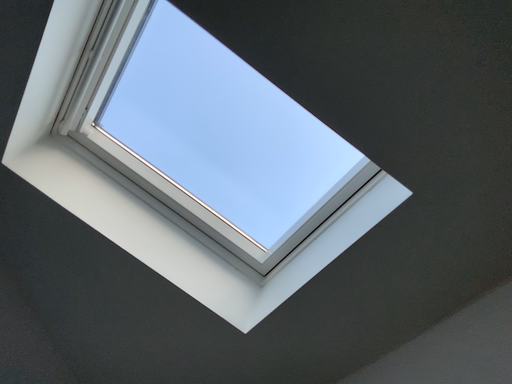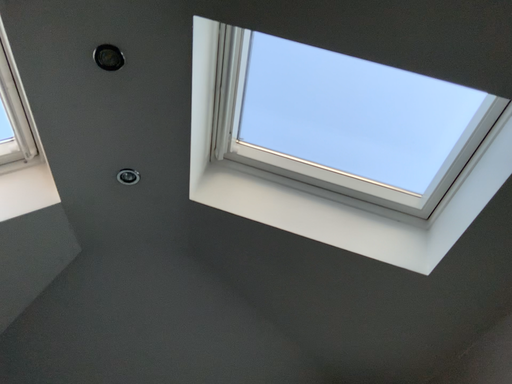
Question: How did the camera likely rotate when shooting the video?

Choices:
 (A) rotated right
 (B) rotated left

Answer: (B)